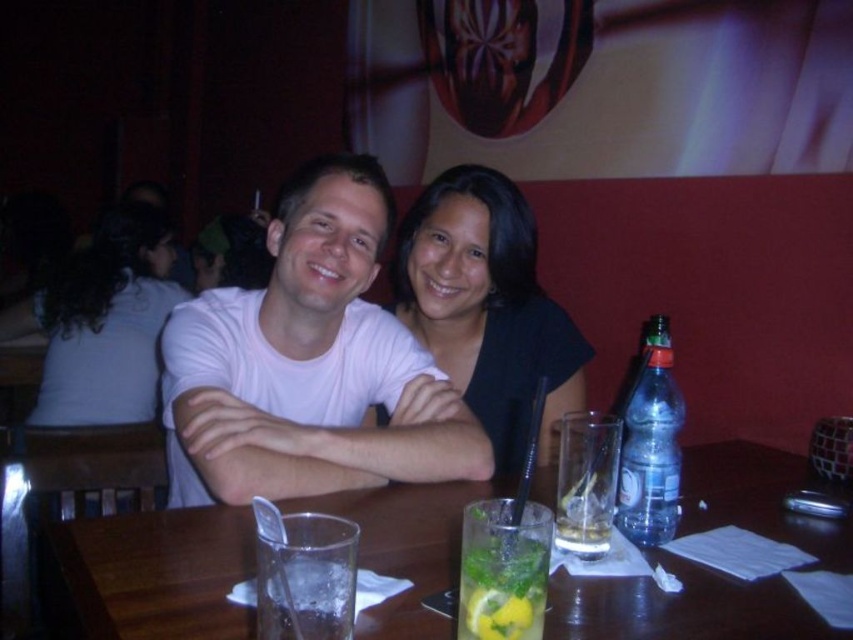
Who is higher up, transparent glass at center or white matte shirt at center?

A: white matte shirt at center is higher up.

Where is `transparent glass at center`? This screenshot has height=640, width=853. transparent glass at center is located at coordinates (148, 576).

Is transparent glass at center above black matte shirt at center?

No.

Find the location of `transparent glass at center`. transparent glass at center is located at coordinates (148, 576).

Does point (502, 509) come behind point (666, 476)?

No, it is not.

Describe the element at coordinates (503, 570) in the screenshot. The width and height of the screenshot is (853, 640). I see `green leafy drink at center` at that location.

This screenshot has height=640, width=853. Describe the element at coordinates (503, 570) in the screenshot. I see `green leafy drink at center` at that location.

This screenshot has width=853, height=640. What are the coordinates of `green leafy drink at center` in the screenshot? It's located at (503, 570).